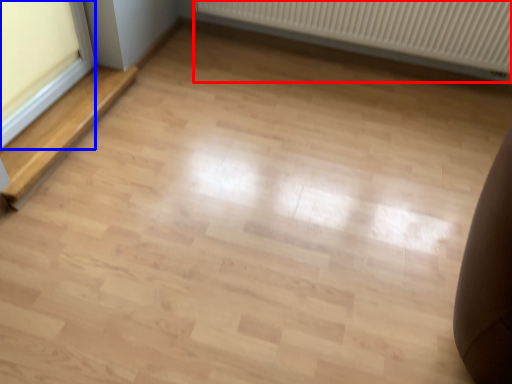
Question: Which object appears farthest to the camera in this image, radiator (highlighted by a red box) or window frame (highlighted by a blue box)?

Choices:
 (A) radiator
 (B) window frame

Answer: (A)